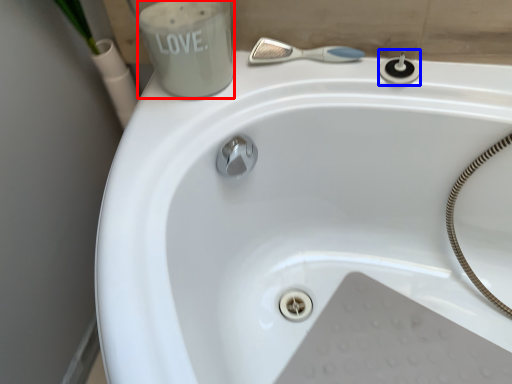
Question: Among these objects, which one is nearest to the camera, liquid (highlighted by a red box) or plumbing fixture (highlighted by a blue box)?

Choices:
 (A) liquid
 (B) plumbing fixture

Answer: (A)